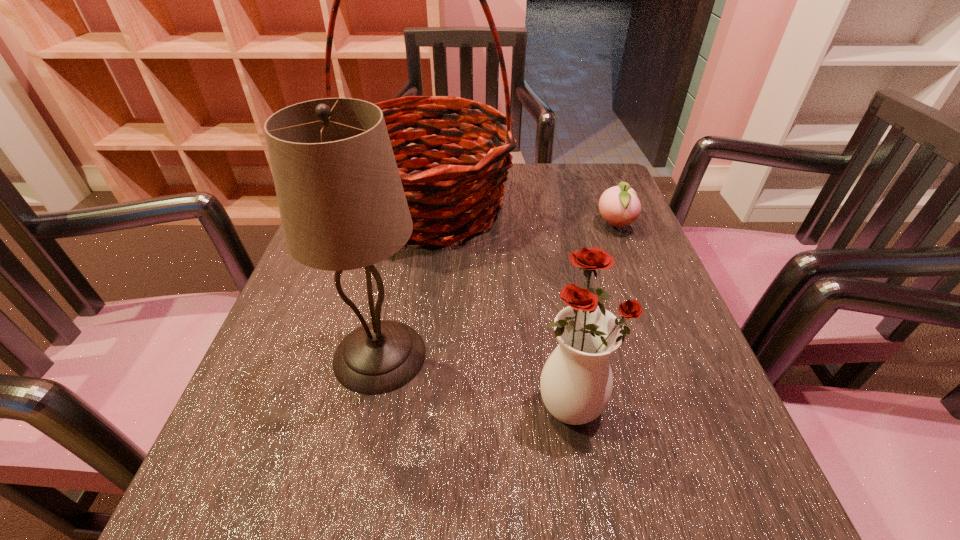
Identify the location of object identified as the second closest to the second shortest object. The image size is (960, 540). (453, 186).

Where is `free region that satisfies the following two spatial constraints: 1. on the front-facing side of the vase; 2. on the right side of the lampshade`? free region that satisfies the following two spatial constraints: 1. on the front-facing side of the vase; 2. on the right side of the lampshade is located at coordinates (371, 401).

You are a GUI agent. You are given a task and a screenshot of the screen. Output one action in this format:
    pyautogui.click(x=<x>, y=<y>)
    Task: Click on the free spot that satisfies the following two spatial constraints: 1. on the front-facing side of the vase; 2. on the left side of the lampshade
    The width and height of the screenshot is (960, 540).
    Given the screenshot: What is the action you would take?
    pyautogui.click(x=371, y=401)

The height and width of the screenshot is (540, 960). Identify the location of free spot that satisfies the following two spatial constraints: 1. on the front-facing side of the second tallest object; 2. on the back side of the second shortest object. (371, 401).

This screenshot has height=540, width=960. In order to click on free spot that satisfies the following two spatial constraints: 1. on the front-facing side of the lampshade; 2. on the right side of the second shortest object in this screenshot , I will do `click(371, 401)`.

Locate an element on the screen. This screenshot has height=540, width=960. free space that satisfies the following two spatial constraints: 1. on the front-facing side of the vase; 2. on the left side of the lampshade is located at coordinates (371, 401).